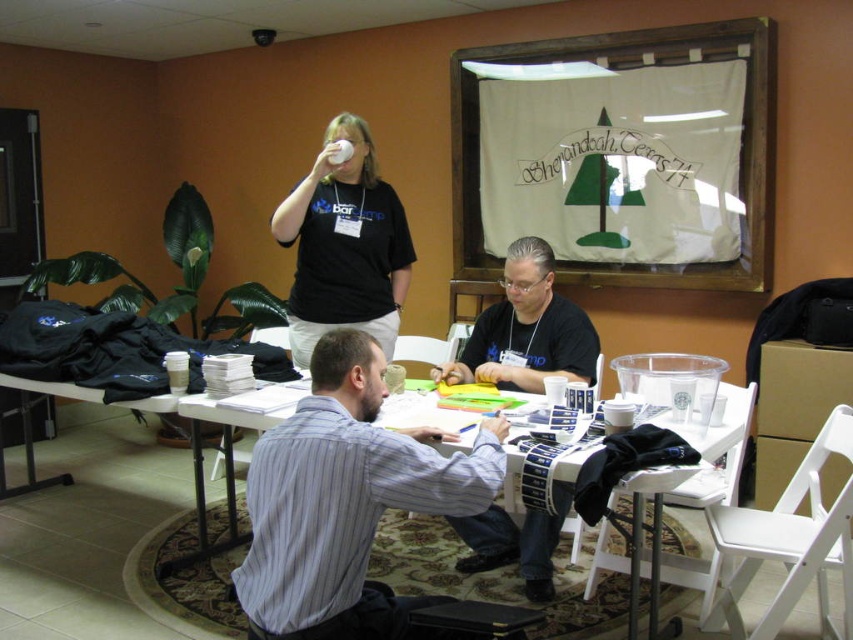
You are a delivery robot with a package that needs to be placed between the striped cotton shirt at center and the black matte shirt at center. The package is 18 inches long. Can you fit it between them without moving either shirt?

The distance between the striped cotton shirt at center and the black matte shirt at center is 38.14 inches. Since the package is only 18 inches long, it can easily fit between them without needing to move either shirt.

You are a photographer setting up a shoot in this room. You need to position a spotlight so that it illuminates the striped cotton shirt at center without casting a shadow on the matte black shirt at upper center. Is this possible given their positions?

The striped cotton shirt at center is in front of the matte black shirt at upper center. Since the striped cotton shirt is closer to the spotlight, it would cast a shadow on the matte black shirt behind it. Therefore, it is not possible to illuminate the striped cotton shirt at center without casting a shadow on the matte black shirt at upper center.